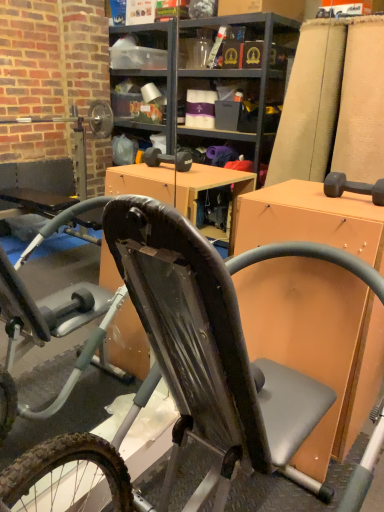
Question: Considering the relative sizes of orange matte desk at center and black rubber bicycle at center in the image provided, is orange matte desk at center taller than black rubber bicycle at center?

Choices:
 (A) yes
 (B) no

Answer: (B)

Question: Are orange matte desk at center and black rubber bicycle at center located far from each other?

Choices:
 (A) yes
 (B) no

Answer: (B)

Question: From the image's perspective, is orange matte desk at center beneath black rubber bicycle at center?

Choices:
 (A) yes
 (B) no

Answer: (B)

Question: Is orange matte desk at center oriented towards black rubber bicycle at center?

Choices:
 (A) no
 (B) yes

Answer: (A)

Question: Considering the relative sizes of orange matte desk at center and black rubber bicycle at center in the image provided, is orange matte desk at center bigger than black rubber bicycle at center?

Choices:
 (A) yes
 (B) no

Answer: (B)

Question: Can you confirm if orange matte desk at center is positioned to the right of black rubber bicycle at center?

Choices:
 (A) yes
 (B) no

Answer: (A)

Question: Would you say black rubber bicycle at center is outside orange matte desk at center?

Choices:
 (A) no
 (B) yes

Answer: (B)

Question: Are black rubber bicycle at center and orange matte desk at center making contact?

Choices:
 (A) yes
 (B) no

Answer: (B)

Question: Is black rubber bicycle at center positioned far away from orange matte desk at center?

Choices:
 (A) yes
 (B) no

Answer: (B)

Question: Is black rubber bicycle at center positioned behind orange matte desk at center?

Choices:
 (A) no
 (B) yes

Answer: (A)

Question: From the image's perspective, is black rubber bicycle at center located above orange matte desk at center?

Choices:
 (A) yes
 (B) no

Answer: (B)

Question: Is orange matte desk at center at the back of black rubber bicycle at center?

Choices:
 (A) no
 (B) yes

Answer: (A)

Question: From the image's perspective, relative to orange matte desk at center, is black rubber bicycle at center above or below?

Choices:
 (A) below
 (B) above

Answer: (A)